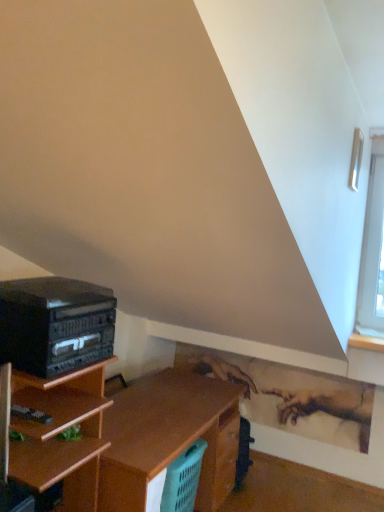
Question: Is black matte stereo at left not close to clear glass window at upper right?

Choices:
 (A) no
 (B) yes

Answer: (B)

Question: Does black matte stereo at left lie behind clear glass window at upper right?

Choices:
 (A) no
 (B) yes

Answer: (A)

Question: Considering the relative positions of black matte stereo at left and clear glass window at upper right in the image provided, is black matte stereo at left to the left of clear glass window at upper right from the viewer's perspective?

Choices:
 (A) no
 (B) yes

Answer: (B)

Question: Could clear glass window at upper right be considered to be inside black matte stereo at left?

Choices:
 (A) no
 (B) yes

Answer: (A)

Question: Is black matte stereo at left positioned in front of clear glass window at upper right?

Choices:
 (A) no
 (B) yes

Answer: (B)

Question: Can you confirm if black matte stereo at left is wider than clear glass window at upper right?

Choices:
 (A) yes
 (B) no

Answer: (A)

Question: Is black matte stereo at left next to teal plastic laundry basket at lower center and touching it?

Choices:
 (A) no
 (B) yes

Answer: (A)

Question: From the image's perspective, is black matte stereo at left on top of teal plastic laundry basket at lower center?

Choices:
 (A) no
 (B) yes

Answer: (B)

Question: Would you say teal plastic laundry basket at lower center is part of black matte stereo at left's contents?

Choices:
 (A) yes
 (B) no

Answer: (B)

Question: Can you confirm if black matte stereo at left is positioned to the left of teal plastic laundry basket at lower center?

Choices:
 (A) no
 (B) yes

Answer: (B)

Question: Is black matte stereo at left aimed at teal plastic laundry basket at lower center?

Choices:
 (A) yes
 (B) no

Answer: (B)

Question: Does black matte stereo at left appear on the right side of teal plastic laundry basket at lower center?

Choices:
 (A) yes
 (B) no

Answer: (B)

Question: Can you confirm if clear glass window at upper right is bigger than black matte stereo at left?

Choices:
 (A) no
 (B) yes

Answer: (A)